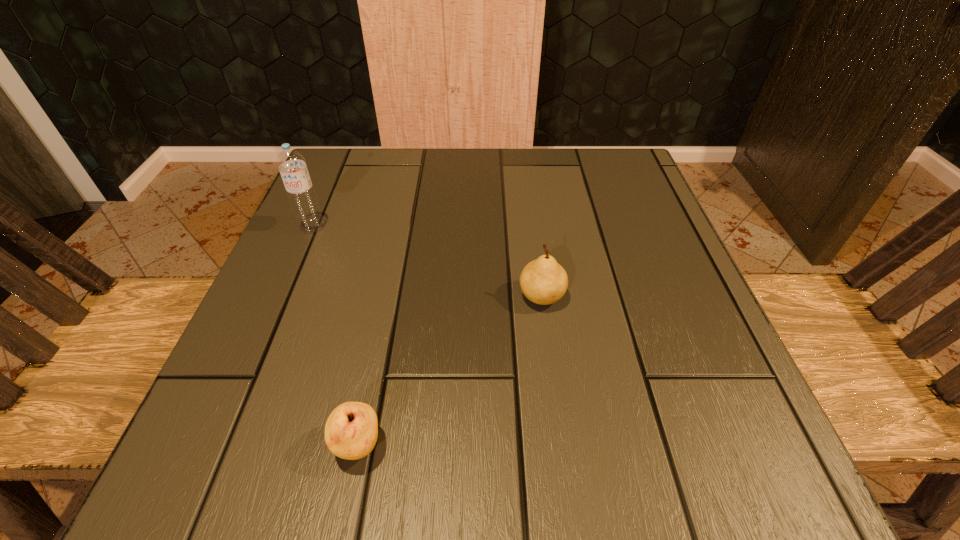
Locate an element on the screen. water bottle is located at coordinates (292, 165).

Locate an element on the screen. the tallest object is located at coordinates (292, 165).

You are a GUI agent. You are given a task and a screenshot of the screen. Output one action in this format:
    pyautogui.click(x=<x>, y=<y>)
    Task: Click on the rightmost object
    The width and height of the screenshot is (960, 540).
    Given the screenshot: What is the action you would take?
    pyautogui.click(x=543, y=281)

At what (x,y) coordinates should I click in order to perform the action: click on the farther pear. Please return your answer as a coordinate pair (x, y). Looking at the image, I should click on (543, 281).

This screenshot has width=960, height=540. I want to click on the shorter pear, so click(x=351, y=431).

Find the location of a particular element. the nearest object is located at coordinates (351, 431).

This screenshot has width=960, height=540. I want to click on free region located on the right of the tallest object, so click(x=390, y=227).

Image resolution: width=960 pixels, height=540 pixels. Identify the location of vacant space located 0.210m on the front of the second shortest object. (561, 438).

I want to click on vacant space located on the back of the left pear, so click(x=373, y=370).

This screenshot has width=960, height=540. Find the location of `object present at the near edge`. object present at the near edge is located at coordinates (351, 431).